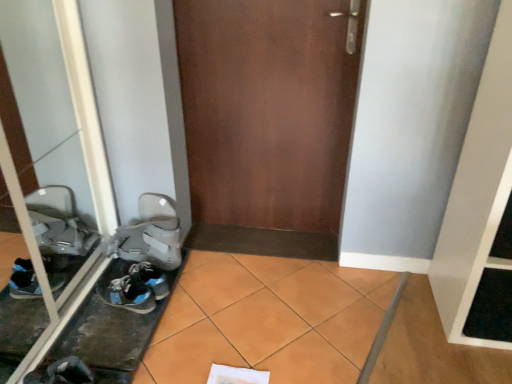
How much space does dark gray fabric sneaker at lower left, marked as the 3th footwear in a top-to-bottom arrangement, occupy horizontally?

The width of dark gray fabric sneaker at lower left, marked as the 3th footwear in a top-to-bottom arrangement, is 12.28 inches.

The width and height of the screenshot is (512, 384). What are the coordinates of `transparent glass door at left` in the screenshot? It's located at (56, 162).

Which of these two, transparent glass door at left or brown matte door at center, stands shorter?

brown matte door at center.

Is point (90, 250) closer to camera compared to point (192, 19)?

No, (90, 250) is behind (192, 19).

Is transparent glass door at left to the left of brown matte door at center from the viewer's perspective?

Indeed, transparent glass door at left is positioned on the left side of brown matte door at center.

Is transparent glass door at left inside brown matte door at center?

No, transparent glass door at left is not a part of brown matte door at center.

Who is taller, brown matte door at center or transparent glass door at left?

transparent glass door at left is taller.

Which of these two, brown matte door at center or transparent glass door at left, is wider?

With larger width is brown matte door at center.

Looking at this image, from a real-world perspective, is brown matte door at center below gray fabric sneaker at lower left, which is the 3th footwear from bottom to top?

No, from a real-world perspective, brown matte door at center is not below gray fabric sneaker at lower left, which is the 3th footwear from bottom to top.

Is brown matte door at center taller than gray fabric sneaker at lower left, the 3th footwear when ordered from front to back?

Correct, brown matte door at center is much taller as gray fabric sneaker at lower left, the 3th footwear when ordered from front to back.

Starting from the brown matte door at center, which footwear is the 2nd one behind? Please provide its 2D coordinates.

[(150, 235)]

Does brown matte door at center have a greater width compared to blue synthetic sneakers at lower left, the 2th footwear in the back-to-front sequence?

No, brown matte door at center is not wider than blue synthetic sneakers at lower left, the 2th footwear in the back-to-front sequence.

Consider the image. Considering the positions of objects brown matte door at center and blue synthetic sneakers at lower left, the 2th footwear in the back-to-front sequence, in the image provided, who is more to the right, brown matte door at center or blue synthetic sneakers at lower left, the 2th footwear in the back-to-front sequence,?

brown matte door at center is more to the right.

Would you consider brown matte door at center to be distant from blue synthetic sneakers at lower left, which ranks as the second footwear in bottom-to-top order?

That's not correct — brown matte door at center is a little close to blue synthetic sneakers at lower left, which ranks as the second footwear in bottom-to-top order.

Considering the points (309, 81) and (136, 276), which point is in front, point (309, 81) or point (136, 276)?

Positioned in front is point (136, 276).

Does blue synthetic sneakers at lower left, which is the 2th footwear in front-to-back order, have a lesser height compared to dark gray fabric sneaker at lower left, the 1th footwear from the bottom?

Correct, blue synthetic sneakers at lower left, which is the 2th footwear in front-to-back order, is not as tall as dark gray fabric sneaker at lower left, the 1th footwear from the bottom.

Is blue synthetic sneakers at lower left, acting as the second footwear starting from the top, closer to the viewer compared to dark gray fabric sneaker at lower left, the 1th footwear from the bottom?

No, it is behind dark gray fabric sneaker at lower left, the 1th footwear from the bottom.

Is blue synthetic sneakers at lower left, which ranks as the second footwear in bottom-to-top order, facing away from dark gray fabric sneaker at lower left, which appears as the third footwear when viewed from the back?

No, blue synthetic sneakers at lower left, which ranks as the second footwear in bottom-to-top order, is not facing away from dark gray fabric sneaker at lower left, which appears as the third footwear when viewed from the back.

Can you confirm if blue synthetic sneakers at lower left, the 2th footwear in the back-to-front sequence, is positioned to the right of dark gray fabric sneaker at lower left, the 1th footwear from the bottom?

Correct, you'll find blue synthetic sneakers at lower left, the 2th footwear in the back-to-front sequence, to the right of dark gray fabric sneaker at lower left, the 1th footwear from the bottom.

Consider the image. Is gray fabric sneaker at lower left, which is the 1th footwear from top to bottom, bigger or smaller than dark gray fabric sneaker at lower left, which appears as the third footwear when viewed from the back?

Clearly, gray fabric sneaker at lower left, which is the 1th footwear from top to bottom, is larger in size than dark gray fabric sneaker at lower left, which appears as the third footwear when viewed from the back.

Is gray fabric sneaker at lower left, which is the first footwear from back to front, oriented away from dark gray fabric sneaker at lower left, the 1th footwear from the bottom?

gray fabric sneaker at lower left, which is the first footwear from back to front, does not have its back to dark gray fabric sneaker at lower left, the 1th footwear from the bottom.

Which object is closer to the camera, gray fabric sneaker at lower left, which is the first footwear from back to front, or dark gray fabric sneaker at lower left, which is the 1th footwear in front-to-back order?

dark gray fabric sneaker at lower left, which is the 1th footwear in front-to-back order.

Considering the positions of point (176, 230) and point (88, 383), is point (176, 230) closer or farther from the camera than point (88, 383)?

Point (176, 230) is farther from the camera than point (88, 383).

Is gray fabric sneaker at lower left, which is the 1th footwear from top to bottom, to the left or to the right of transparent glass door at left in the image?

gray fabric sneaker at lower left, which is the 1th footwear from top to bottom, is to the right of transparent glass door at left.

Is gray fabric sneaker at lower left, which is the 1th footwear from top to bottom, outside of transparent glass door at left?

Yes, gray fabric sneaker at lower left, which is the 1th footwear from top to bottom, is not within transparent glass door at left.

Does gray fabric sneaker at lower left, which is the 3th footwear from bottom to top, have a greater width compared to transparent glass door at left?

Correct, the width of gray fabric sneaker at lower left, which is the 3th footwear from bottom to top, exceeds that of transparent glass door at left.

How many degrees apart are the facing directions of gray fabric sneaker at lower left, the 3th footwear when ordered from front to back, and transparent glass door at left?

Answer: The angular difference between gray fabric sneaker at lower left, the 3th footwear when ordered from front to back, and transparent glass door at left is 0.977 degrees.

At what (x,y) coordinates should I click in order to perform the action: click on door on the right of the transparent glass door at left. Please return your answer as a coordinate pair (x, y). This screenshot has width=512, height=384. Looking at the image, I should click on (267, 121).

The height and width of the screenshot is (384, 512). I want to click on glass door that appears on the left of brown matte door at center, so click(56, 162).

When comparing their distances from transparent glass door at left, does dark gray fabric sneaker at lower left, which appears as the third footwear when viewed from the back, or brown matte door at center seem closer?

The object closer to transparent glass door at left is dark gray fabric sneaker at lower left, which appears as the third footwear when viewed from the back.

Considering their positions, is dark gray fabric sneaker at lower left, which appears as the third footwear when viewed from the back, positioned closer to transparent glass door at left than blue synthetic sneakers at lower left, which ranks as the second footwear in bottom-to-top order?

Based on the image, blue synthetic sneakers at lower left, which ranks as the second footwear in bottom-to-top order, appears to be nearer to transparent glass door at left.

Consider the image. Looking at the image, which one is located further to brown matte door at center, dark gray fabric sneaker at lower left, marked as the 3th footwear in a top-to-bottom arrangement, or gray fabric sneaker at lower left, the 3th footwear when ordered from front to back?

dark gray fabric sneaker at lower left, marked as the 3th footwear in a top-to-bottom arrangement, is further to brown matte door at center.

Looking at the image, which one is located closer to dark gray fabric sneaker at lower left, marked as the 3th footwear in a top-to-bottom arrangement, gray fabric sneaker at lower left, which is the 3th footwear from bottom to top, or blue synthetic sneakers at lower left, the 2th footwear in the back-to-front sequence?

Among the two, blue synthetic sneakers at lower left, the 2th footwear in the back-to-front sequence, is located nearer to dark gray fabric sneaker at lower left, marked as the 3th footwear in a top-to-bottom arrangement.

Based on their spatial positions, is dark gray fabric sneaker at lower left, which is the 1th footwear in front-to-back order, or transparent glass door at left closer to brown matte door at center?

The object closer to brown matte door at center is transparent glass door at left.

Based on their spatial positions, is brown matte door at center or gray fabric sneaker at lower left, which is the first footwear from back to front, closer to transparent glass door at left?

gray fabric sneaker at lower left, which is the first footwear from back to front.

Looking at the image, which one is located closer to dark gray fabric sneaker at lower left, the 1th footwear from the bottom, brown matte door at center or gray fabric sneaker at lower left, the 3th footwear when ordered from front to back?

Among the two, gray fabric sneaker at lower left, the 3th footwear when ordered from front to back, is located nearer to dark gray fabric sneaker at lower left, the 1th footwear from the bottom.

Which object lies further to the anchor point gray fabric sneaker at lower left, which is the 3th footwear from bottom to top, brown matte door at center or transparent glass door at left?

Among the two, brown matte door at center is located further to gray fabric sneaker at lower left, which is the 3th footwear from bottom to top.

I want to click on footwear between dark gray fabric sneaker at lower left, which appears as the third footwear when viewed from the back, and gray fabric sneaker at lower left, which is the 3th footwear from bottom to top, from front to back, so click(133, 286).

Where is `footwear between transparent glass door at left and blue synthetic sneakers at lower left, which ranks as the second footwear in bottom-to-top order, from front to back`? This screenshot has height=384, width=512. footwear between transparent glass door at left and blue synthetic sneakers at lower left, which ranks as the second footwear in bottom-to-top order, from front to back is located at coordinates (68, 372).

Where is `glass door between brown matte door at center and dark gray fabric sneaker at lower left, the 1th footwear from the bottom, in the vertical direction`? glass door between brown matte door at center and dark gray fabric sneaker at lower left, the 1th footwear from the bottom, in the vertical direction is located at coordinates (56, 162).

At what (x,y) coordinates should I click in order to perform the action: click on door between transparent glass door at left and gray fabric sneaker at lower left, which is the 3th footwear from bottom to top, in the front-back direction. Please return your answer as a coordinate pair (x, y). This screenshot has height=384, width=512. Looking at the image, I should click on (267, 121).